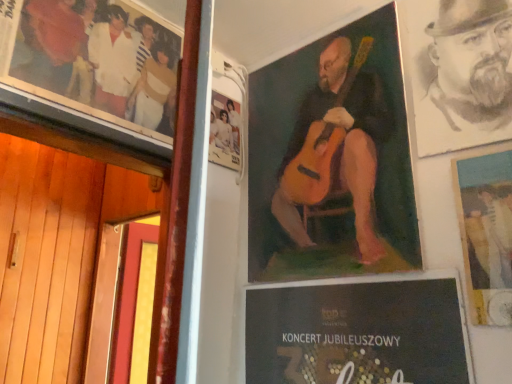
Question: Is matte paper poster at upper right, the 3th poster from the left, far away from oil painting guitar at center, the 2th poster in the left-to-right sequence?

Choices:
 (A) yes
 (B) no

Answer: (B)

Question: Is matte paper poster at upper right, the 3th poster from the left, turned away from oil painting guitar at center, which is counted as the 2th poster, starting from the right?

Choices:
 (A) yes
 (B) no

Answer: (B)

Question: From a real-world perspective, does matte paper poster at upper right, the 3th poster from the left, sit lower than oil painting guitar at center, the 2th poster in the left-to-right sequence?

Choices:
 (A) no
 (B) yes

Answer: (B)

Question: Does matte paper poster at upper right, the 3th poster from the left, have a lesser width compared to oil painting guitar at center, the 2th poster in the left-to-right sequence?

Choices:
 (A) no
 (B) yes

Answer: (A)

Question: Does matte paper poster at upper right, the 3th poster from the left, come in front of oil painting guitar at center, the 2th poster in the left-to-right sequence?

Choices:
 (A) no
 (B) yes

Answer: (B)

Question: Based on their positions, is vintage photo album at upper left, the 1th poster in the left-to-right sequence, located to the left or right of charcoal sketch of man at upper right?

Choices:
 (A) left
 (B) right

Answer: (A)

Question: Is point (154, 74) closer or farther from the camera than point (456, 39)?

Choices:
 (A) farther
 (B) closer

Answer: (A)

Question: From the image's perspective, relative to charcoal sketch of man at upper right, is vintage photo album at upper left, acting as the 3th poster starting from the right, above or below?

Choices:
 (A) below
 (B) above

Answer: (B)

Question: In the image, is vintage photo album at upper left, the 1th poster in the left-to-right sequence, positioned in front of or behind charcoal sketch of man at upper right?

Choices:
 (A) behind
 (B) front

Answer: (A)

Question: In terms of size, does vintage photo album at upper left, the 1th poster in the left-to-right sequence, appear bigger or smaller than oil painting guitar at center, the 2th poster in the left-to-right sequence?

Choices:
 (A) small
 (B) big

Answer: (B)

Question: Considering the positions of point (128, 112) and point (339, 100), is point (128, 112) closer or farther from the camera than point (339, 100)?

Choices:
 (A) closer
 (B) farther

Answer: (A)

Question: Relative to oil painting guitar at center, which is counted as the 2th poster, starting from the right, is vintage photo album at upper left, the 1th poster in the left-to-right sequence, in front or behind?

Choices:
 (A) front
 (B) behind

Answer: (A)

Question: In terms of height, does vintage photo album at upper left, the 1th poster in the left-to-right sequence, look taller or shorter compared to oil painting guitar at center, the 2th poster in the left-to-right sequence?

Choices:
 (A) short
 (B) tall

Answer: (A)

Question: From the image's perspective, is oil painting guitar at center, which is counted as the 2th poster, starting from the right, above or below vintage photo album at upper left, the 1th poster in the left-to-right sequence?

Choices:
 (A) above
 (B) below

Answer: (B)

Question: Looking at the image, does oil painting guitar at center, which is counted as the 2th poster, starting from the right, seem bigger or smaller compared to vintage photo album at upper left, acting as the 3th poster starting from the right?

Choices:
 (A) big
 (B) small

Answer: (B)